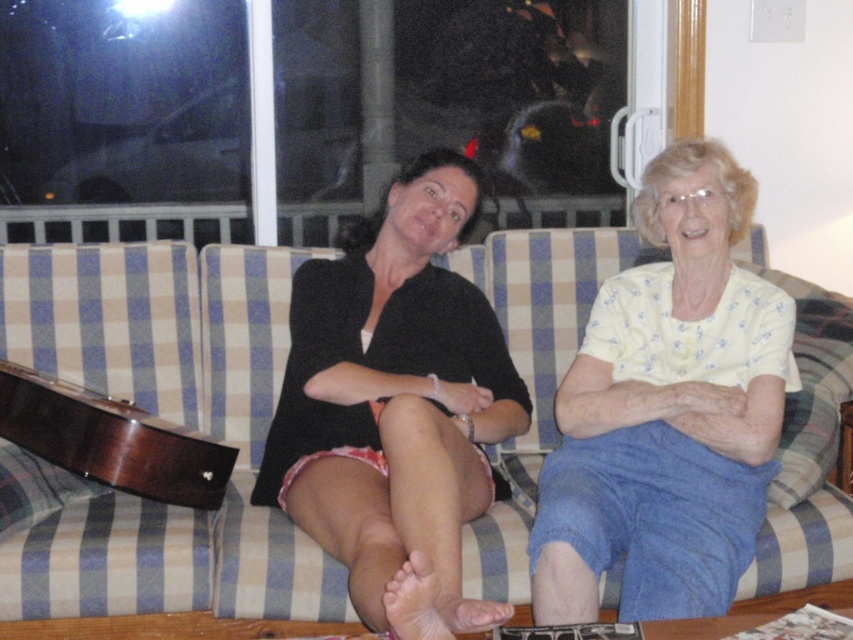
Between light yellow printed blouse at center and dark wood guitar at lower left, which one appears on the left side from the viewer's perspective?

From the viewer's perspective, dark wood guitar at lower left appears more on the left side.

Is point (587, 324) positioned in front of point (190, 500)?

No.

The width and height of the screenshot is (853, 640). Identify the location of light yellow printed blouse at center. (666, 412).

Is the position of light yellow floral blouse at center less distant than that of dark wood guitar at lower left?

Yes.

Can you confirm if light yellow floral blouse at center is positioned to the left of dark wood guitar at lower left?

In fact, light yellow floral blouse at center is to the right of dark wood guitar at lower left.

What are the coordinates of `light yellow floral blouse at center` in the screenshot? It's located at (395, 406).

Locate an element on the screen. This screenshot has height=640, width=853. light yellow floral blouse at center is located at coordinates (395, 406).

Is blue plaid couch at center to the right of dark wood guitar at lower left from the viewer's perspective?

Yes, blue plaid couch at center is to the right of dark wood guitar at lower left.

Does blue plaid couch at center have a lesser width compared to dark wood guitar at lower left?

No.

Image resolution: width=853 pixels, height=640 pixels. What do you see at coordinates (160, 416) in the screenshot?
I see `blue plaid couch at center` at bounding box center [160, 416].

Locate an element on the screen. This screenshot has width=853, height=640. blue plaid couch at center is located at coordinates (160, 416).